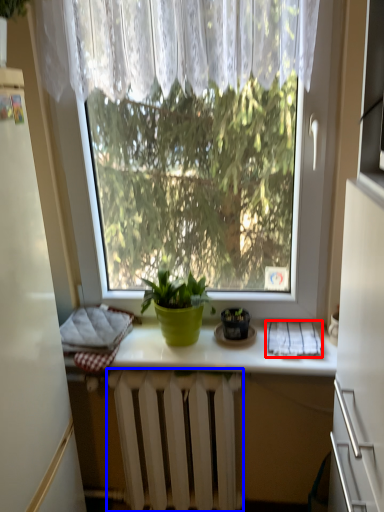
Question: Which of the following is the closest to the observer, cloth (highlighted by a red box) or radiator (highlighted by a blue box)?

Choices:
 (A) cloth
 (B) radiator

Answer: (A)